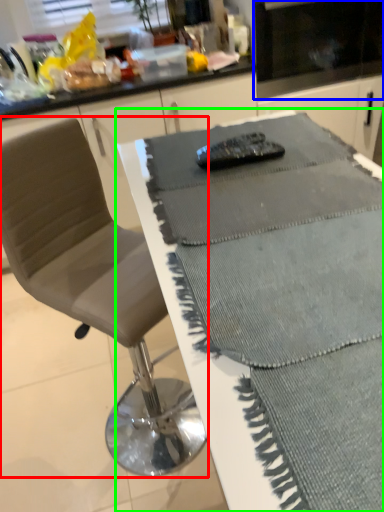
Question: Estimate the real-world distances between objects in this image. Which object is farther from chair (highlighted by a red box), appliance (highlighted by a blue box) or table (highlighted by a green box)?

Choices:
 (A) appliance
 (B) table

Answer: (A)